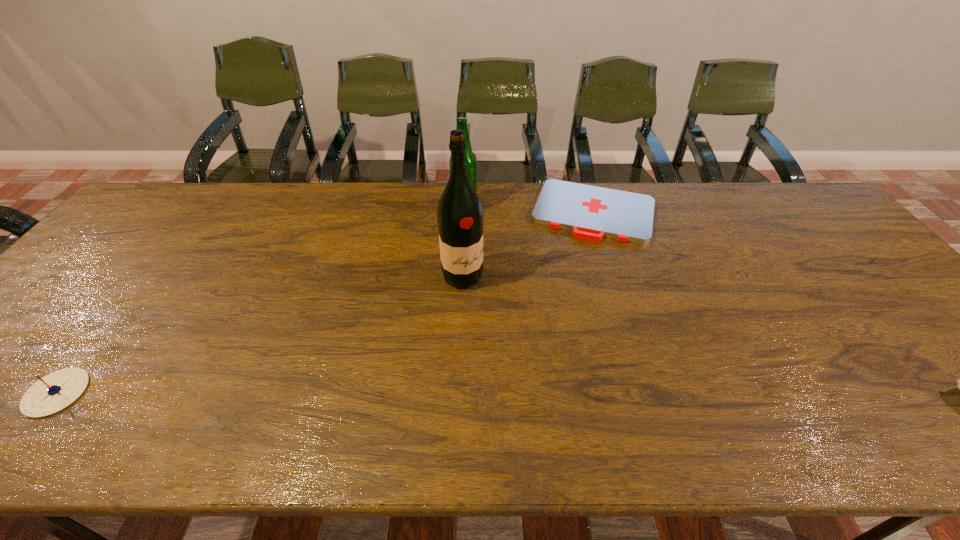
Where is `compass`? compass is located at coordinates 54,392.

Locate an element on the screen. The height and width of the screenshot is (540, 960). the nearest object is located at coordinates (54, 392).

At what (x,y) coordinates should I click in order to perform the action: click on liquor. Please return your answer as a coordinate pair (x, y). This screenshot has width=960, height=540. Looking at the image, I should click on (460, 216).

Where is `the second nearest object`? the second nearest object is located at coordinates (460, 216).

Locate an element on the screen. This screenshot has width=960, height=540. the third shortest object is located at coordinates (470, 158).

Where is `the shortest object`? The image size is (960, 540). the shortest object is located at coordinates (592, 213).

Where is `the rightmost object`? The width and height of the screenshot is (960, 540). the rightmost object is located at coordinates (592, 213).

Where is `free region located 0.090m on the right of the nearest object`? free region located 0.090m on the right of the nearest object is located at coordinates (127, 393).

The image size is (960, 540). In order to click on free region located 0.260m on the front-facing side of the liquor in this screenshot , I will do `click(538, 353)`.

Image resolution: width=960 pixels, height=540 pixels. What are the coordinates of `free space located on the front-facing side of the liquor` in the screenshot? It's located at (516, 331).